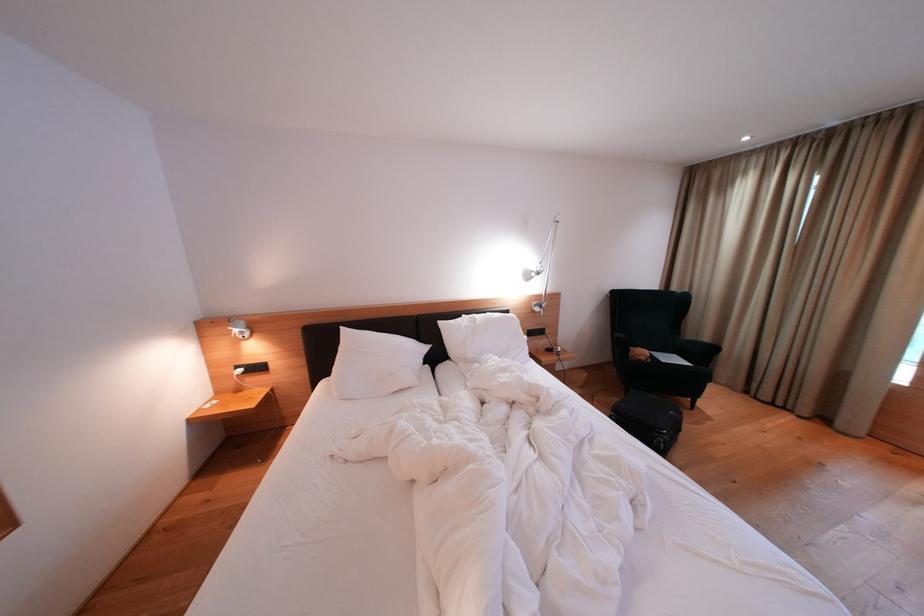
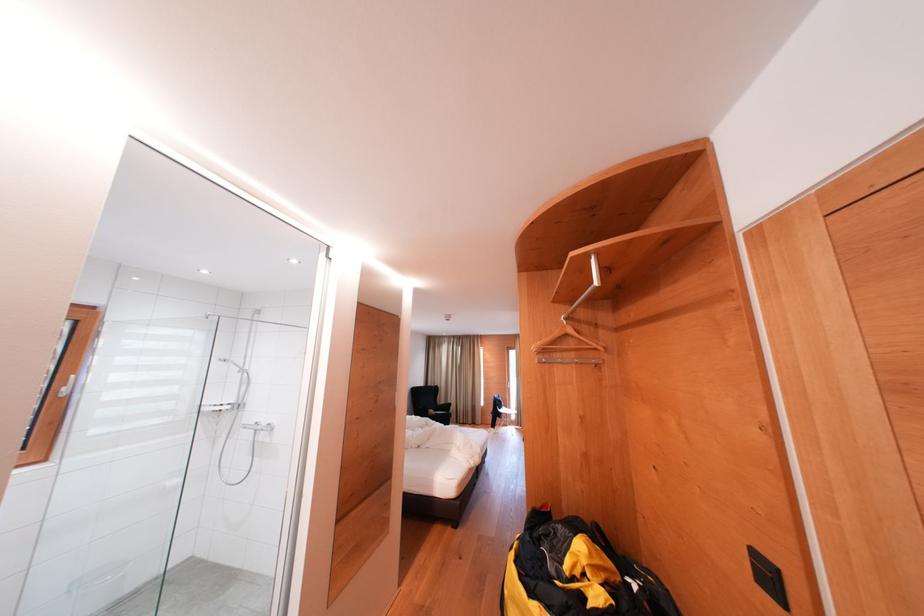
The point at (648, 357) is marked in the first image. Where is the corresponding point in the second image?

(439, 416)